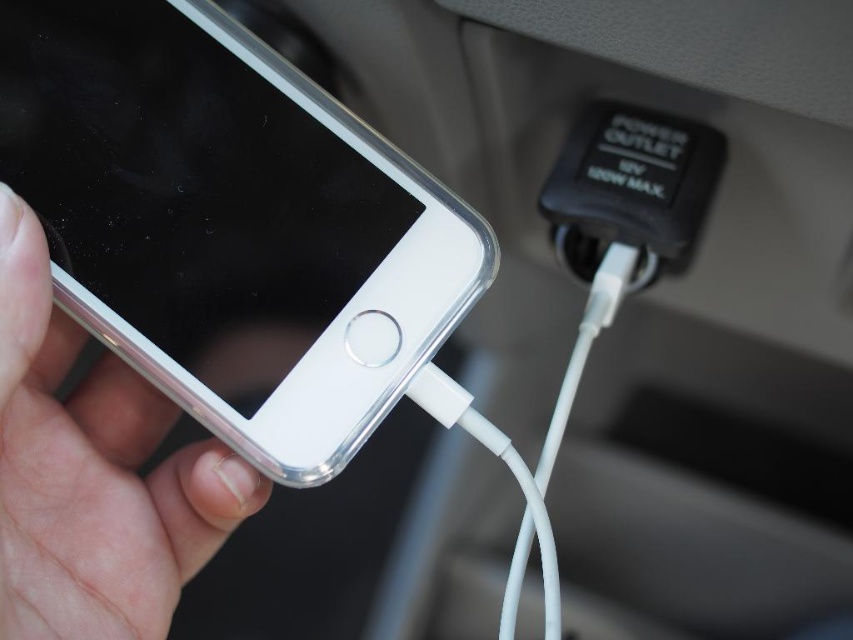
Does clear plastic smartphone at left appear under silver metallic phone at lower left?

No.

Identify the location of clear plastic smartphone at left. (231, 225).